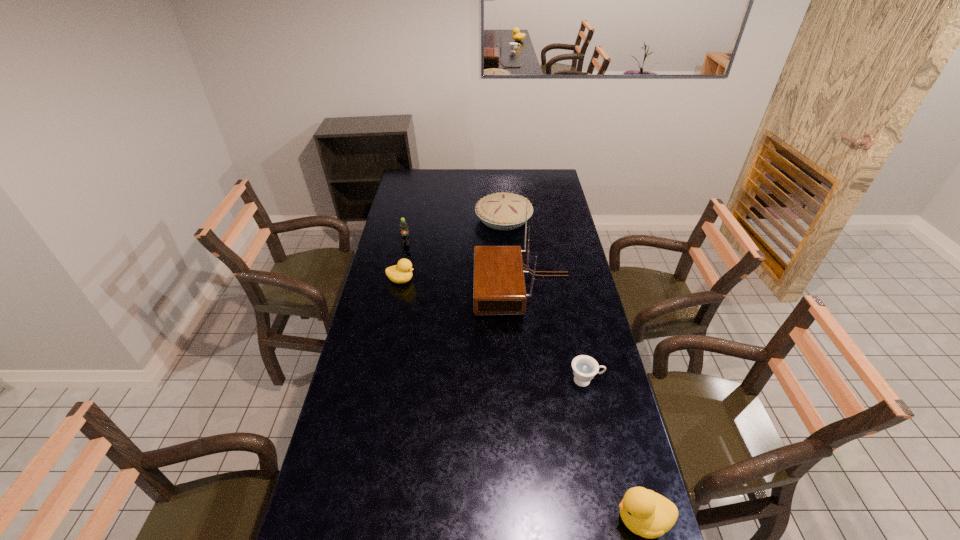
To achieve uniform spacing by inserting another duck among them, please point to a free space for this new duck. Please provide its 2D coordinates. Your answer should be formatted as a tuple, i.e. [(x, y)], where the tuple contains the x and y coordinates of a point satisfying the conditions above.

[(493, 372)]